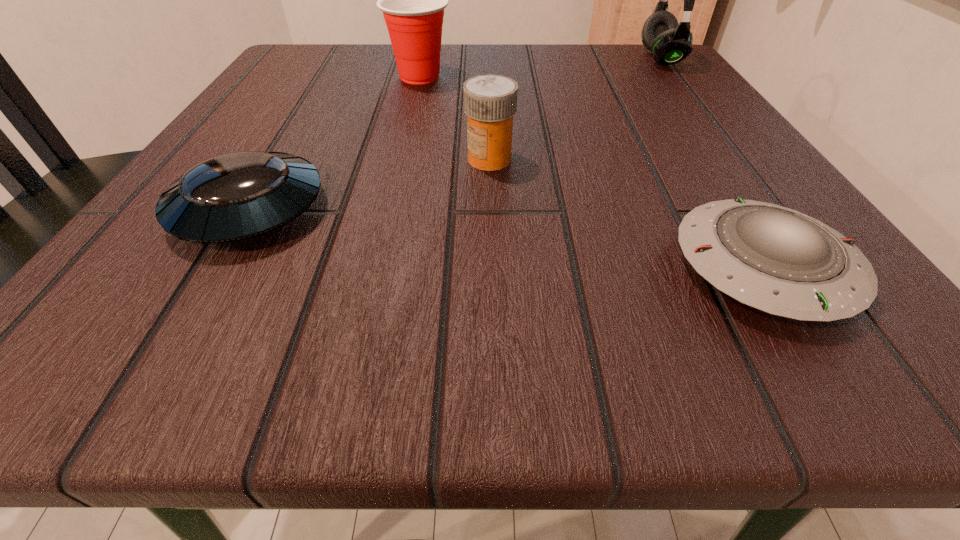
Locate an element on the screen. Image resolution: width=960 pixels, height=540 pixels. free space at the far right corner is located at coordinates (644, 51).

You are a GUI agent. You are given a task and a screenshot of the screen. Output one action in this format:
    pyautogui.click(x=<x>, y=<y>)
    Task: Click on the free space between the second object from left to right and the tallest object
    The height and width of the screenshot is (540, 960).
    Given the screenshot: What is the action you would take?
    pyautogui.click(x=540, y=68)

The height and width of the screenshot is (540, 960). I want to click on empty space between the medicine and the tallest object, so click(x=575, y=109).

This screenshot has height=540, width=960. In order to click on vacant area that lies between the taller saucer and the second tallest object in this screenshot , I will do `click(335, 143)`.

The image size is (960, 540). Find the location of `blank region between the fourth tallest object and the fourth shortest object`. blank region between the fourth tallest object and the fourth shortest object is located at coordinates (335, 143).

Find the location of a particular element. free space between the medicine and the cup is located at coordinates (454, 118).

Identify the location of blank region between the shortest object and the third tallest object. The image size is (960, 540). (626, 213).

Locate an element on the screen. This screenshot has width=960, height=540. free space that is in between the third object from left to right and the tallest object is located at coordinates [x=575, y=109].

This screenshot has width=960, height=540. I want to click on unoccupied area between the second object from left to right and the right saucer, so click(x=591, y=172).

Identify the location of free area in between the medicine and the right saucer. (626, 213).